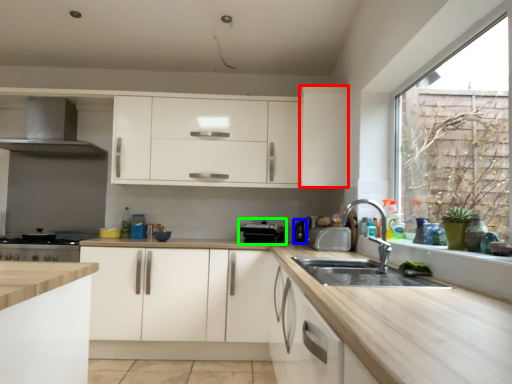
Question: Based on their relative distances, which object is farther from cabinetry (highlighted by a red box)? Choose from appliance (highlighted by a blue box) and appliance (highlighted by a green box).

Choices:
 (A) appliance
 (B) appliance

Answer: (A)